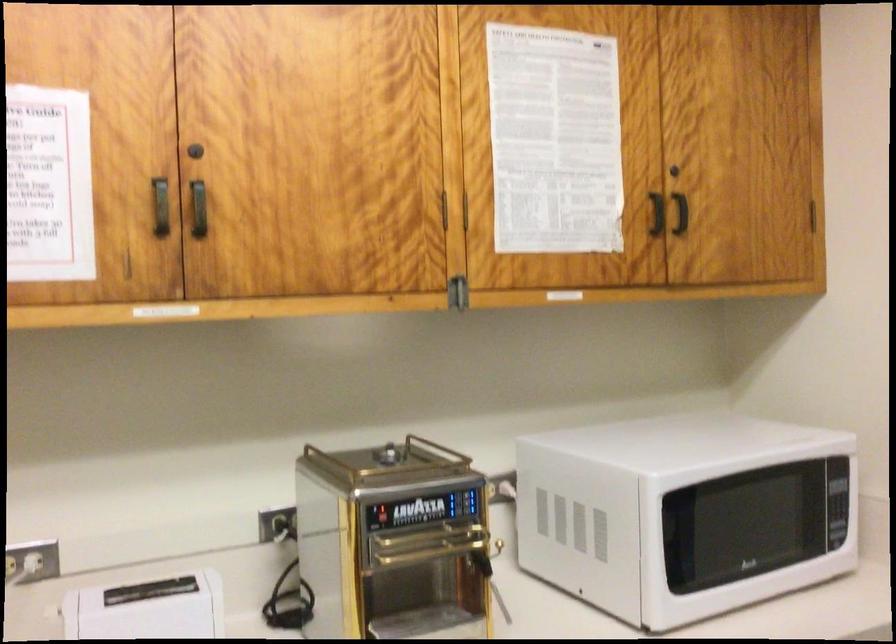
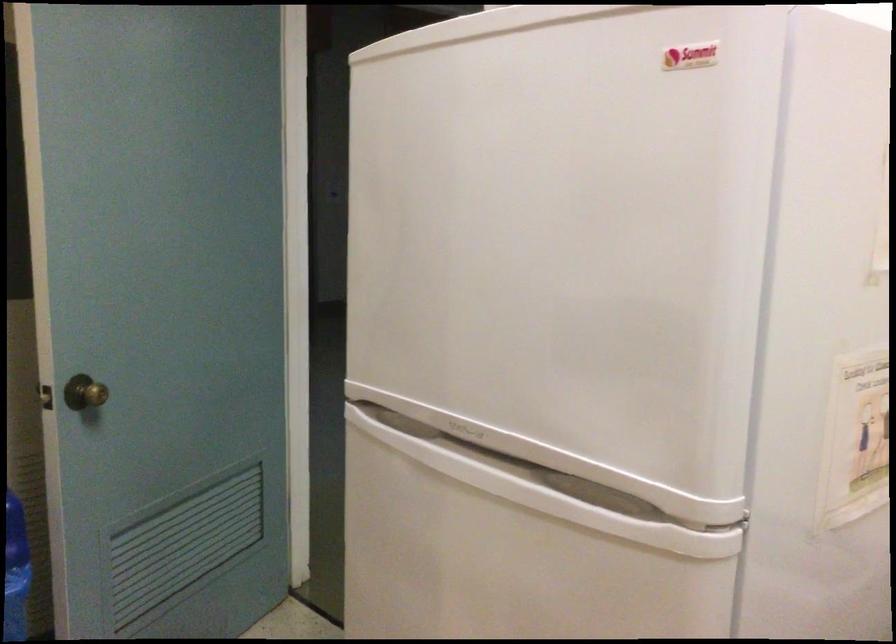
Question: Based on the continuous images, in which direction is the camera rotating? Reply with the corresponding letter.

Choices:
 (A) Left
 (B) Right
 (C) Up
 (D) Down

Answer: (B)